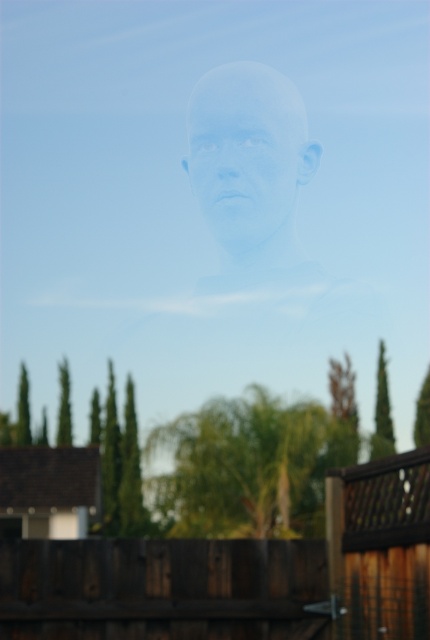
In the scene shown: You are standing at the point marked as point (159,588) in the image. Looking around, you see the brown wooden fence at lower center. What is the nearest object to you?

The nearest object to you is the brown wooden fence at lower center located at point (159,588).

You are an artist trying to paint this scene. You want to ensure the brown wooden fence at lower center and the translucent plastic head at center are proportionally accurate. Which object should you paint larger?

The translucent plastic head at center should be painted larger than the brown wooden fence at lower center because the brown wooden fence at lower center has a smaller size compared to the translucent plastic head at center.